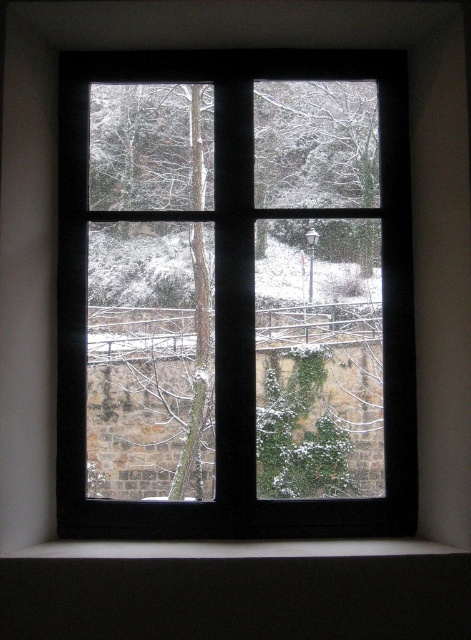
Question: Which point appears closest to the camera in this image?

Choices:
 (A) pos(455,547)
 (B) pos(202,356)

Answer: (A)

Question: Among these objects, which one is farthest from the camera?

Choices:
 (A) white matte window sill at lower center
 (B) black wood window at center

Answer: (B)

Question: Can you confirm if black wood window at center is positioned below white matte window sill at lower center?

Choices:
 (A) yes
 (B) no

Answer: (B)

Question: Among these objects, which one is farthest from the camera?

Choices:
 (A) white matte window sill at lower center
 (B) black wood window at center

Answer: (B)

Question: Does black wood window at center have a lesser width compared to white matte window sill at lower center?

Choices:
 (A) yes
 (B) no

Answer: (A)

Question: Is black wood window at center bigger than white matte window sill at lower center?

Choices:
 (A) no
 (B) yes

Answer: (B)